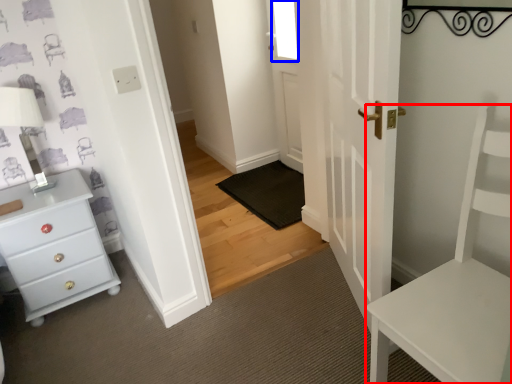
Question: Which object is closer to the camera taking this photo, furniture (highlighted by a red box) or window (highlighted by a blue box)?

Choices:
 (A) furniture
 (B) window

Answer: (A)